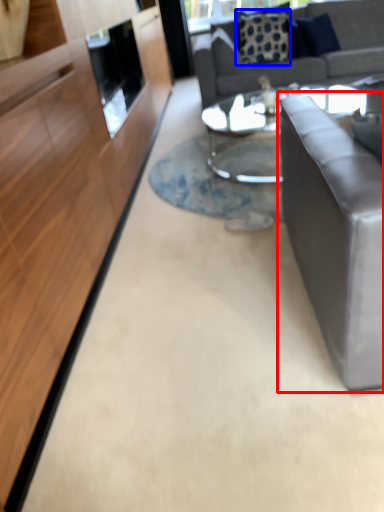
Question: Which point is closer to the camera, studio couch (highlighted by a red box) or pillow (highlighted by a blue box)?

Choices:
 (A) studio couch
 (B) pillow

Answer: (A)